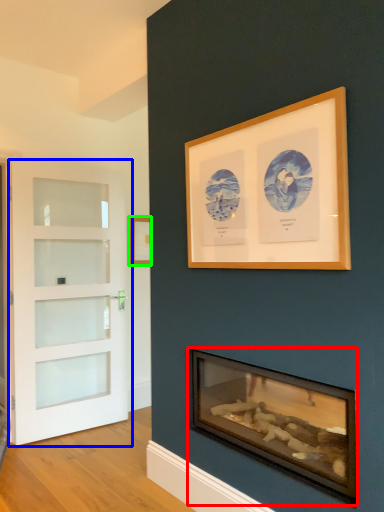
Question: Which object is the closest to the wood burning stove (highlighted by a red box)? Choose among these: door (highlighted by a blue box) or picture frame (highlighted by a green box).

Choices:
 (A) door
 (B) picture frame

Answer: (A)